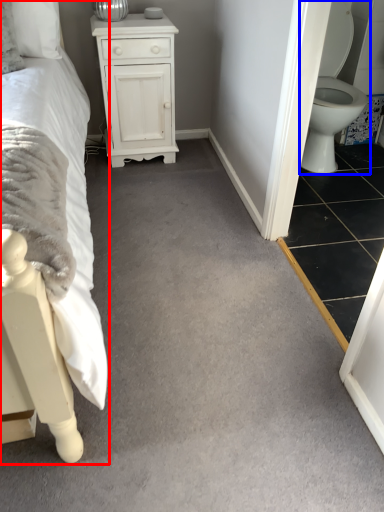
Question: Among these objects, which one is nearest to the camera, bed (highlighted by a red box) or toilet (highlighted by a blue box)?

Choices:
 (A) bed
 (B) toilet

Answer: (A)